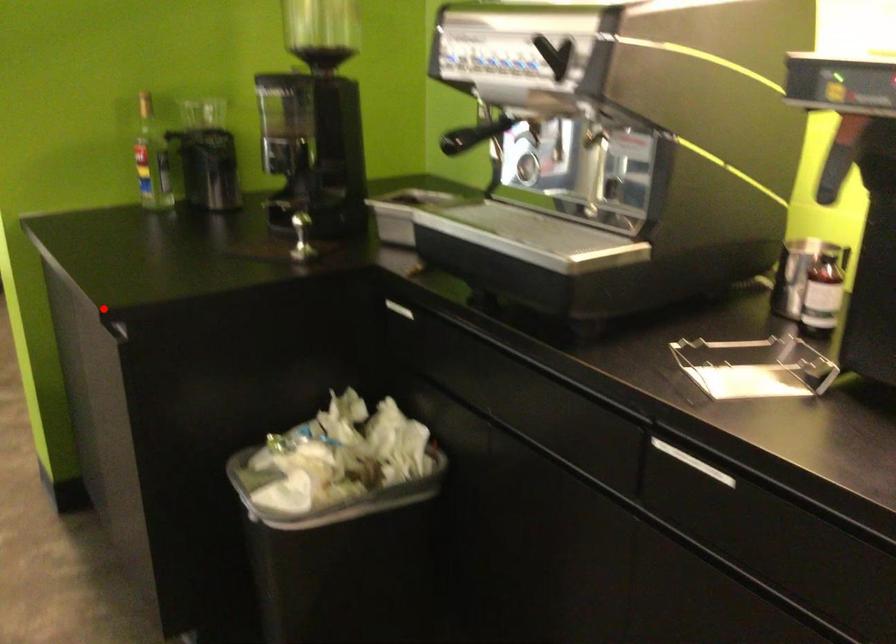
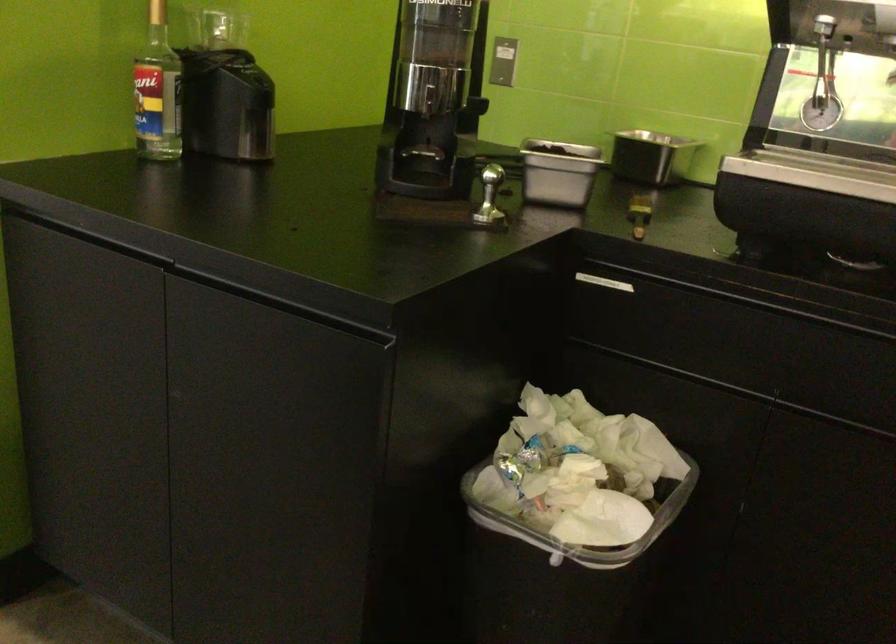
In the second image, find the point that corresponds to the highlighted location in the first image.

(280, 304)